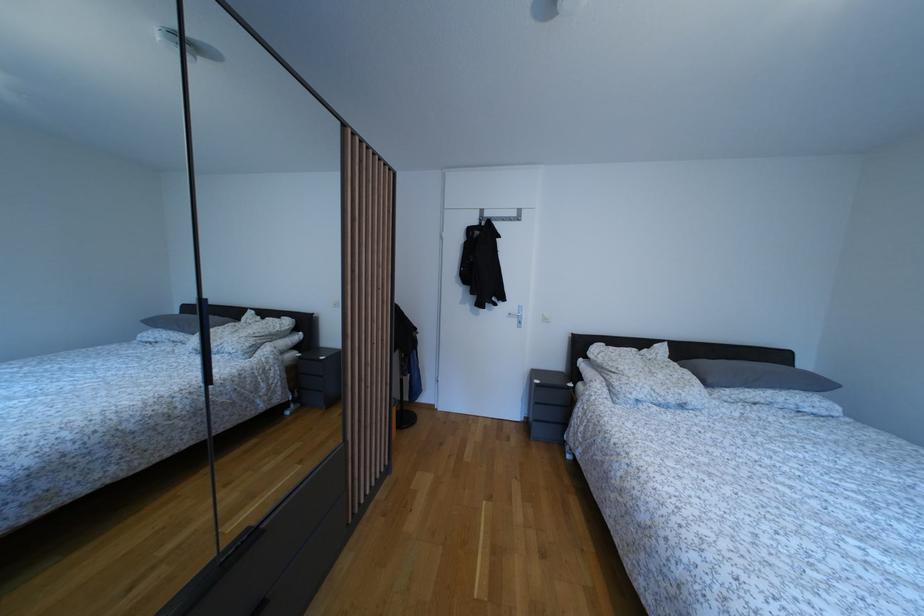
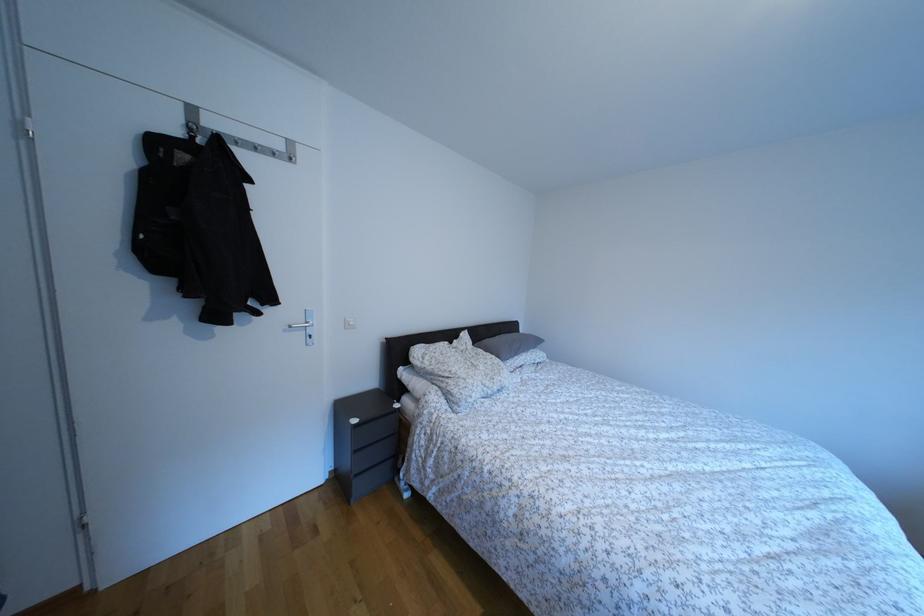
The point at [811,371] is marked in the first image. Where is the corresponding point in the second image?

(529, 336)